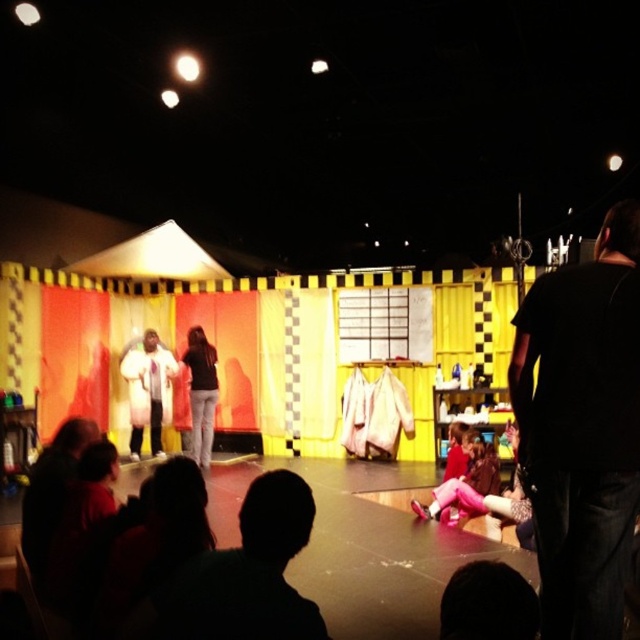
You are an audience member sitting in the front row of the stage. You see the silhouette head at lower center and the black matte jacket at center. Which object is located to the right of the other?

The silhouette head at lower center is positioned on the right side of black matte jacket at center.